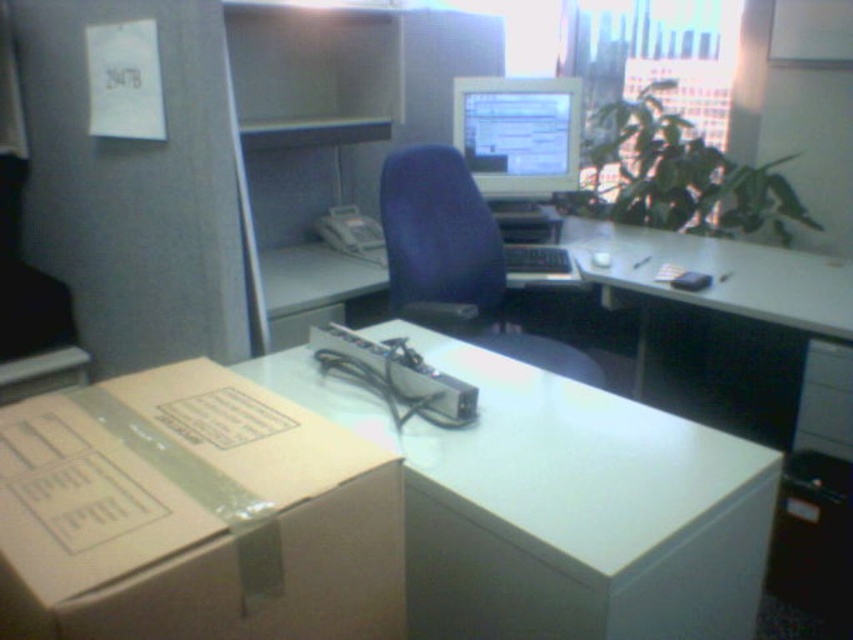
Consider the image. You are organizing an office and need to place a large printer on the desk. The printer requires a surface area larger than the brown cardboard box at lower left. Can the white glossy table at center accommodate the printer?

The brown cardboard box at lower left is smaller than the white glossy table at center, so the white glossy table at center has enough space to accommodate the printer as it is larger than the box.

You are an office worker who needs to move a 30 cm wide package from the brown cardboard box at lower left to the white glossy table at center. Can you place the package directly between them without any obstruction?

The distance between the brown cardboard box at lower left and the white glossy table at center is 34.06 centimeters. Since the package is 30 cm wide, it can be placed between them as the space is sufficient.

You are standing in the office and want to determine which of the two points, point [403,637] or point [424,243], is nearer to you. Based on the scene description, which point is closer?

Point [403,637] is closer to the camera than point [424,243], so it is the nearer point.